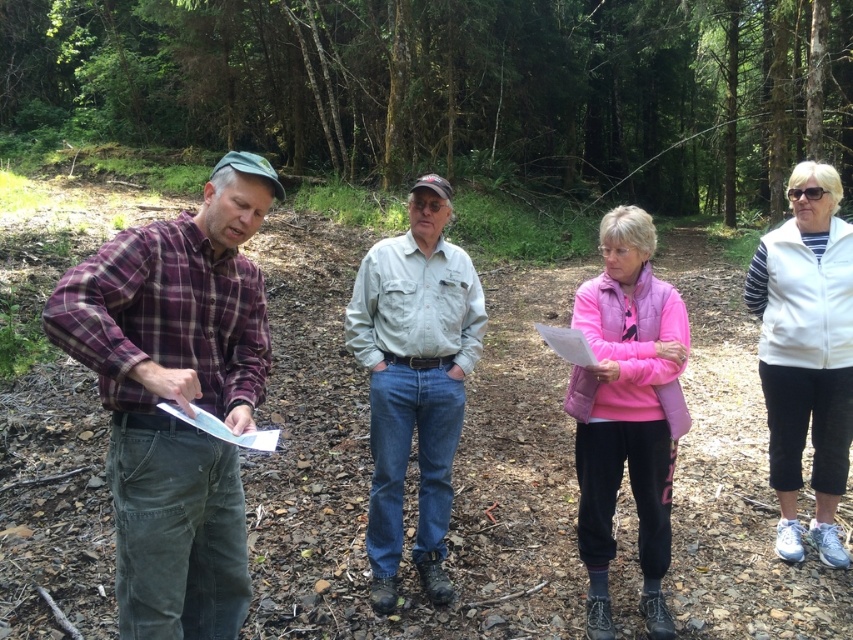
Question: Can you confirm if light gray cotton shirt at center is thinner than pink fleece at center?

Choices:
 (A) no
 (B) yes

Answer: (A)

Question: Among these points, which one is nearest to the camera?

Choices:
 (A) (612, 452)
 (B) (257, 61)

Answer: (A)

Question: Can you confirm if white fleece vest at right is positioned above pink matte clipboard at center?

Choices:
 (A) no
 (B) yes

Answer: (A)

Question: Which of the following is the closest to the observer?

Choices:
 (A) (79, 352)
 (B) (558, 337)
 (C) (241, 134)

Answer: (A)

Question: Which point is farther to the camera?

Choices:
 (A) plaid fabric shirt at left
 (B) white fleece vest at right
 (C) pink fleece at center

Answer: (B)

Question: Considering the relative positions of plaid fabric shirt at left and white fleece vest at right in the image provided, where is plaid fabric shirt at left located with respect to white fleece vest at right?

Choices:
 (A) left
 (B) right

Answer: (A)